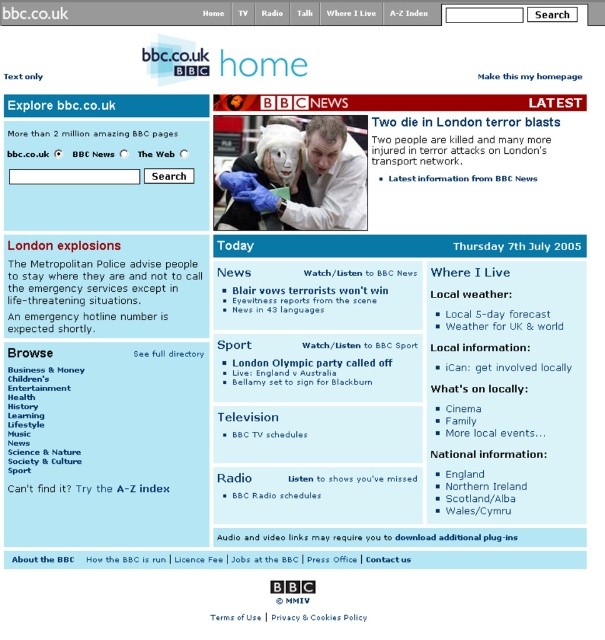
Is white paper at upper left in front of matte white lab coat at center?

That is True.

Where is `white paper at upper left`? Image resolution: width=605 pixels, height=640 pixels. white paper at upper left is located at coordinates (106, 285).